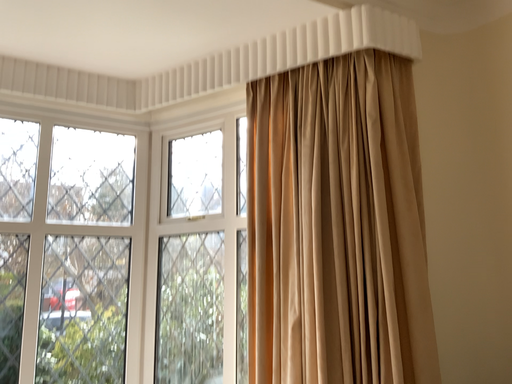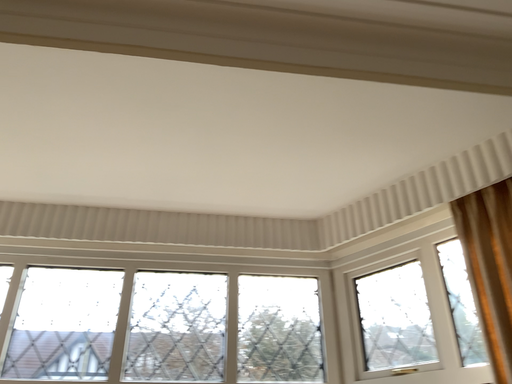
Question: Which way did the camera rotate in the video?

Choices:
 (A) rotated left
 (B) rotated right

Answer: (A)